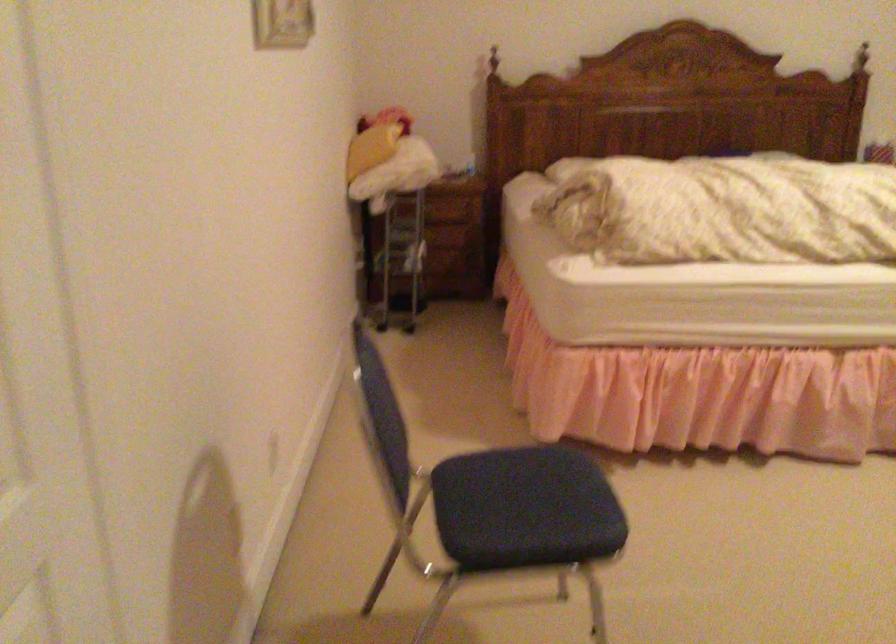
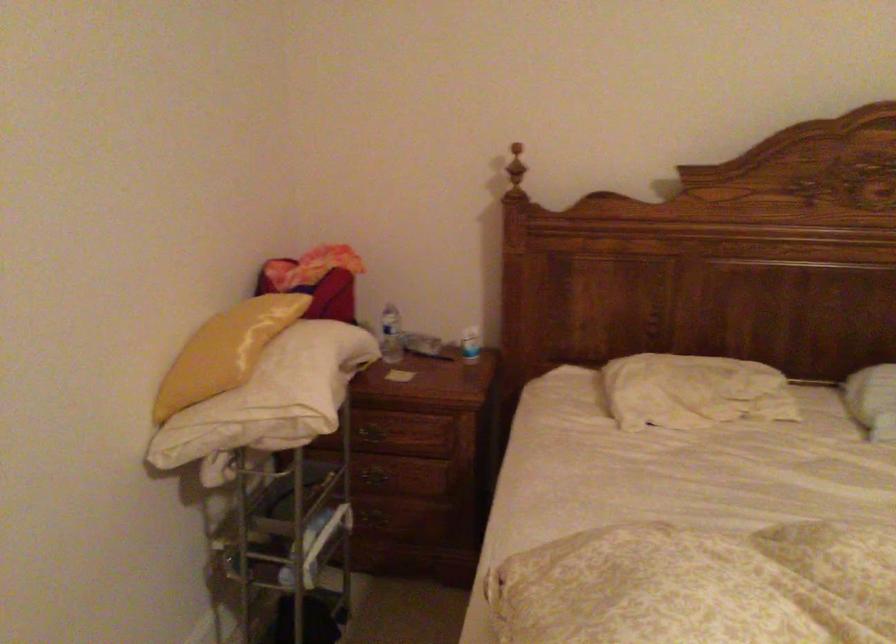
Where in the second image is the point corresponding to point (419, 202) from the first image?

(374, 430)